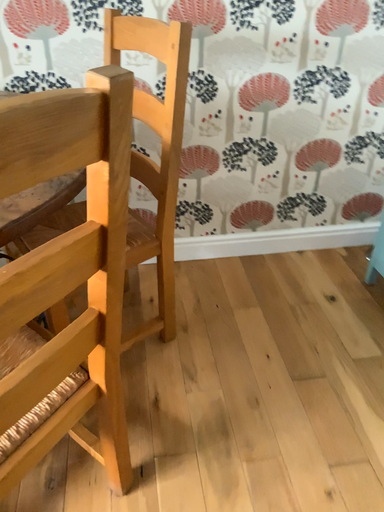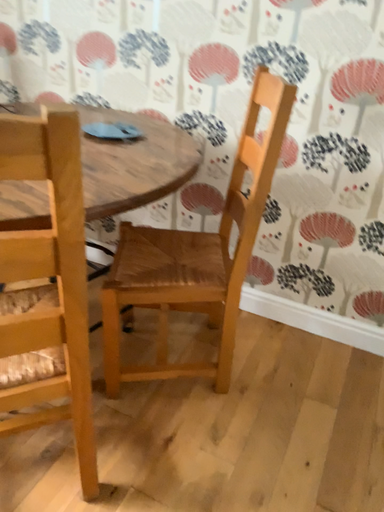
Question: Which way did the camera rotate in the video?

Choices:
 (A) rotated downward
 (B) rotated upward

Answer: (B)